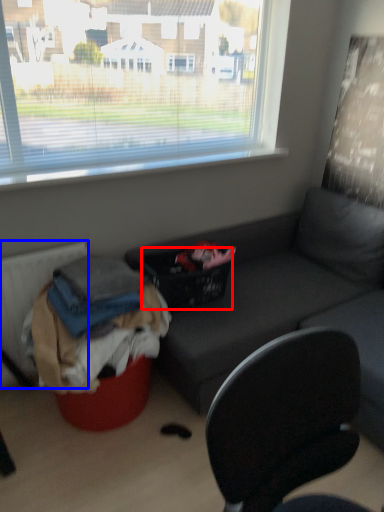
Question: Which of the following is the farthest to the observer, basket (highlighted by a red box) or radiator (highlighted by a blue box)?

Choices:
 (A) basket
 (B) radiator

Answer: (A)